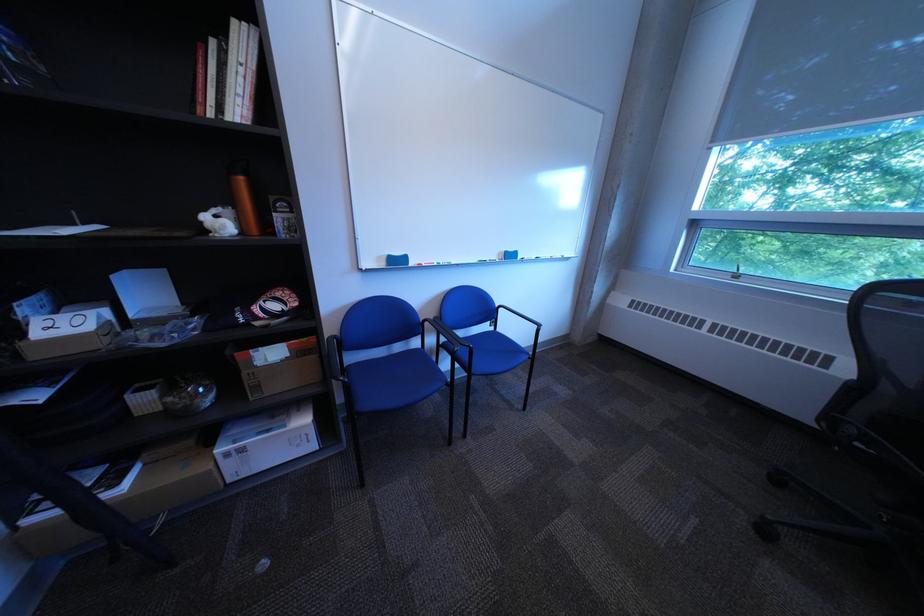
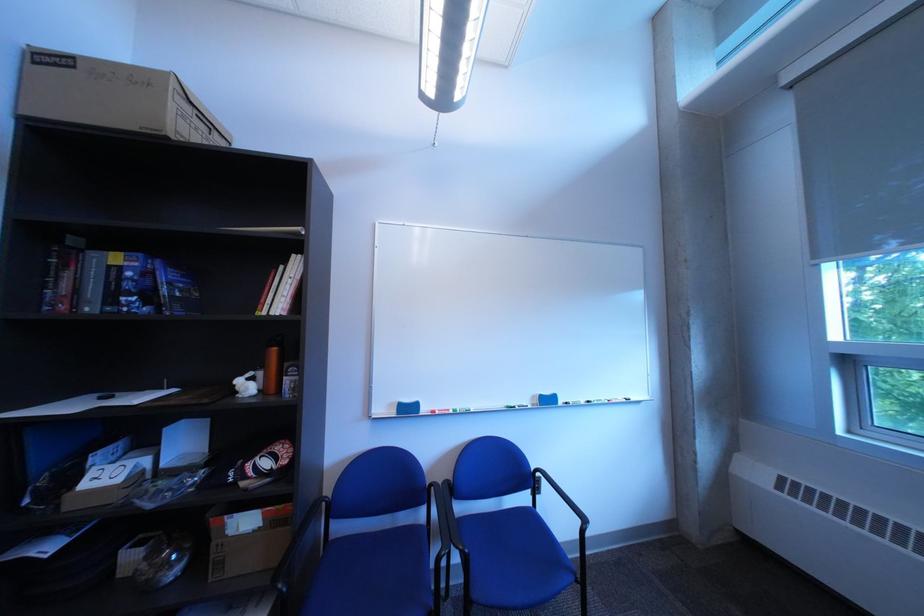
Find the pixel in the second image that matches [228,213] in the first image.

(264, 376)